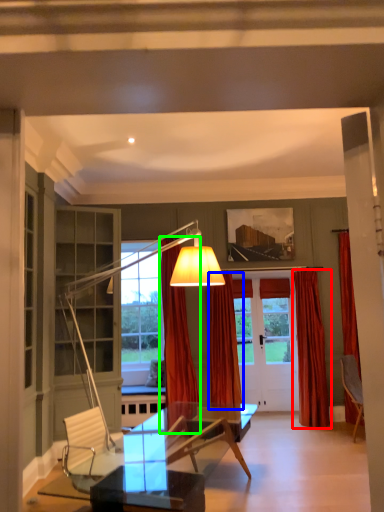
Question: Which object is positioned farthest from curtain (highlighted by a red box)? Select from curtain (highlighted by a blue box) and curtain (highlighted by a green box).

Choices:
 (A) curtain
 (B) curtain

Answer: (B)